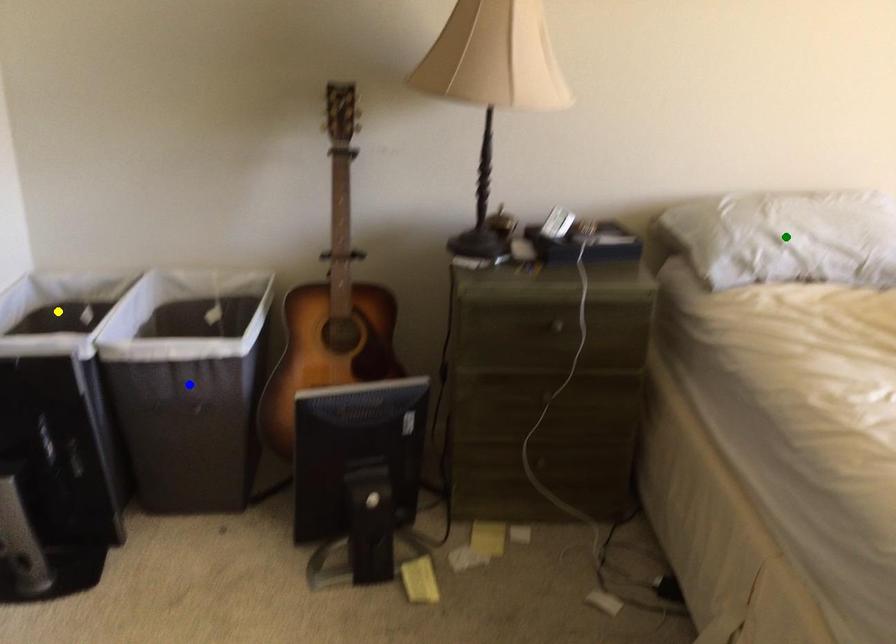
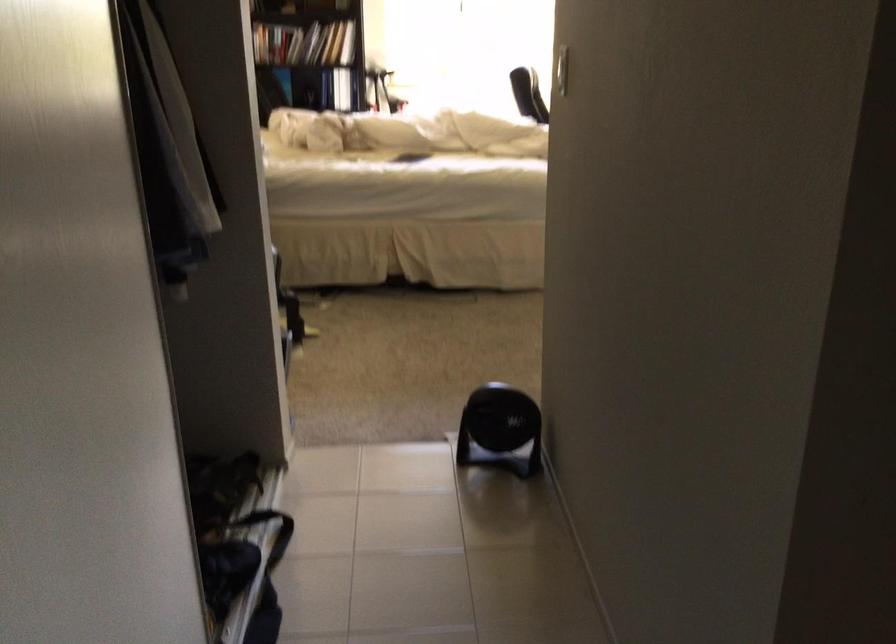
I am providing you with two images of the same scene from different viewpoints. Three points are marked in image1. Which point corresponds to a part or object that is occluded in image2?In image1, three points are marked. Which of them correspond to a part or object that is occluded in image2?Among the three points shown in image1, which one corresponds to a part or object that is no longer visible due to occlusion in image2?

Invisible in image2: green point, blue point, yellow point.